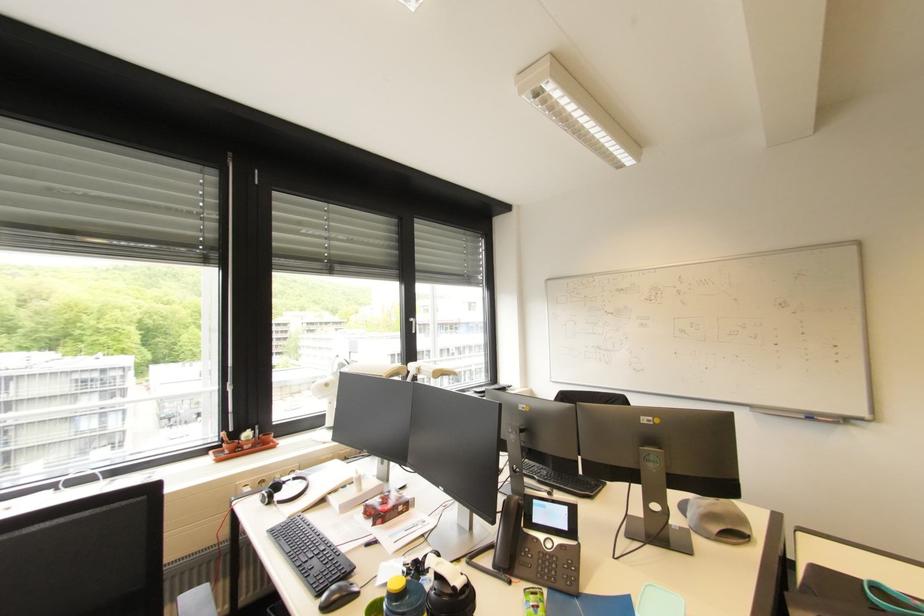
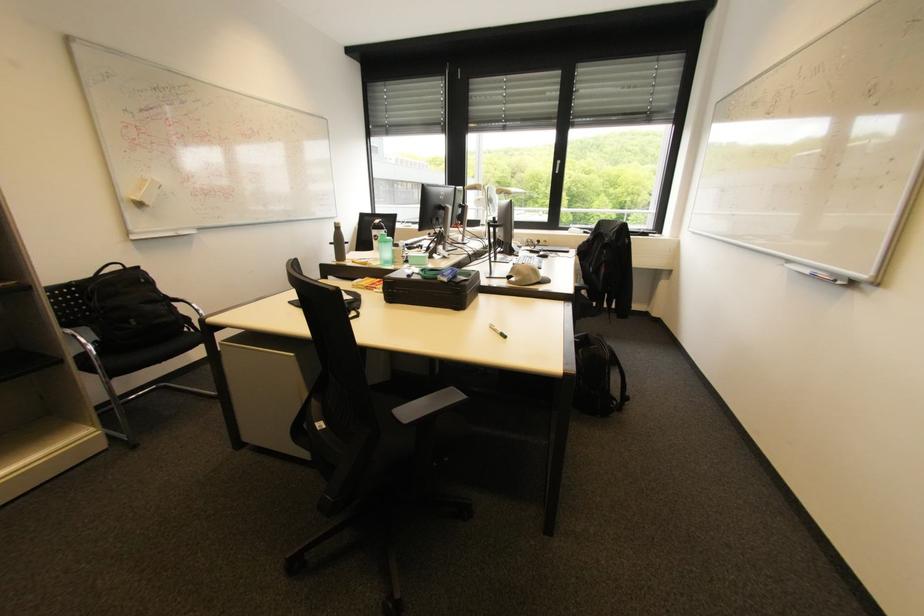
Where in the second image is the point corresponding to pixel 752 408 from the first image?

(789, 262)